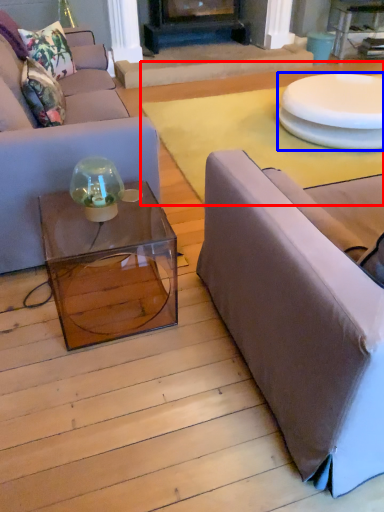
Question: Which point is further to the camera, plain (highlighted by a red box) or round table (highlighted by a blue box)?

Choices:
 (A) plain
 (B) round table

Answer: (B)